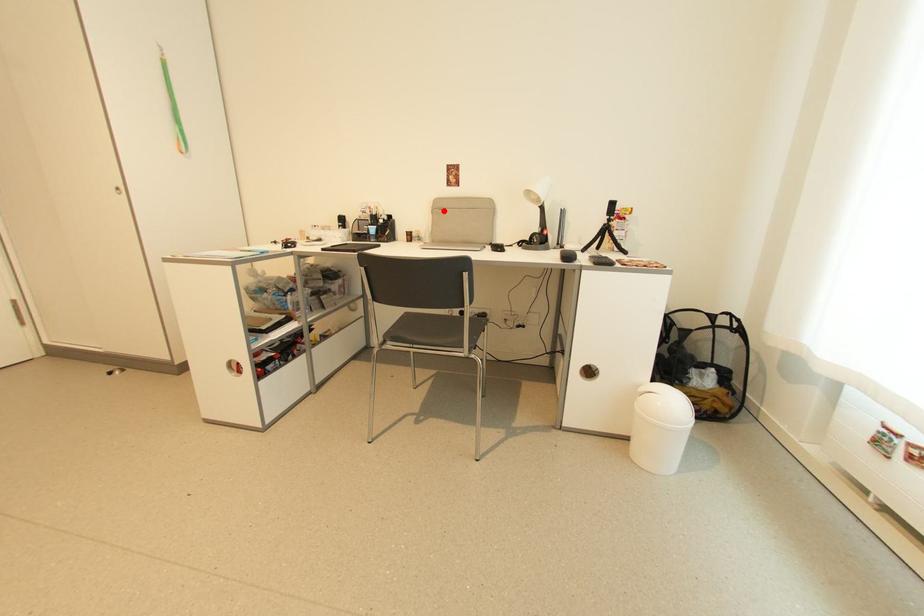
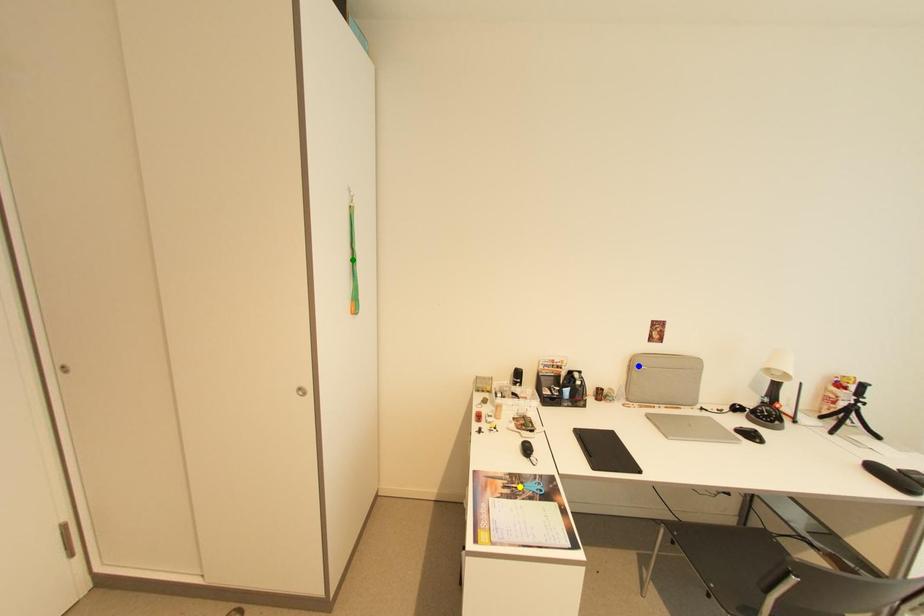
Question: I am providing you with two images of the same scene from different viewpoints. A red point is marked on the first image. You are given multiple points on the second image. Which point in image 2 is actually the same real-world point as the red point in image 1?

Choices:
 (A) yellow point
 (B) blue point
 (C) green point

Answer: (B)